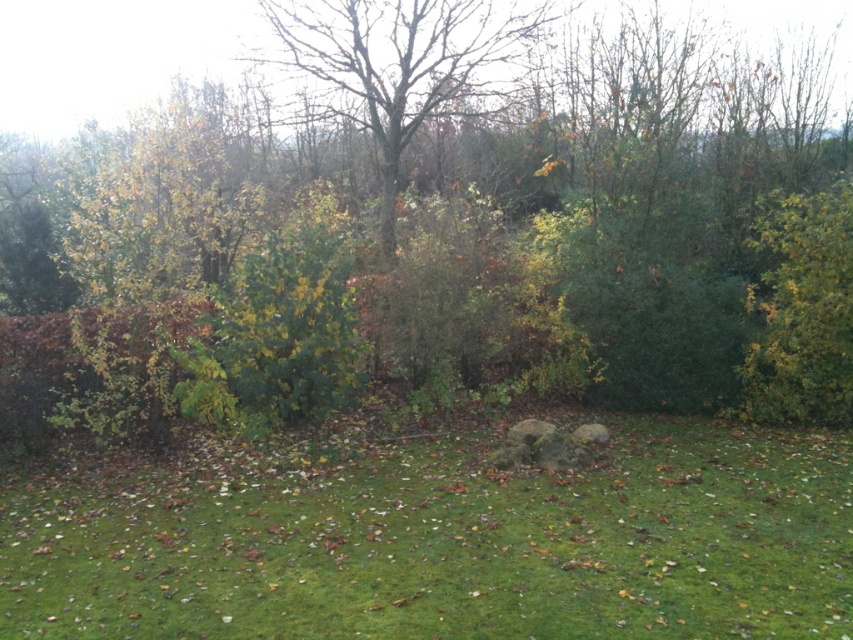
Based on the photo, you are standing in the autumn scene and want to take a photo. There are two points in the image, point (318, 385) and point (465, 17). Which point will appear larger in your photo?

Point (318, 385) is closer to the camera than point (465, 17), so it will appear larger in the photo.

You are standing in the autumn scene and want to place a small garden ornament between the green leafy bush at center and the bare wood tree at center. Based on their positions, which side of the tree should you place it to ensure it is between them?

The green leafy bush at center is to the left of the bare wood tree at center, so placing the ornament to the left side of the tree would position it between them.

You are standing in the middle of the green grassy area at center and want to walk to the edge of the green leafy tree at center. Is the distance you need to walk likely shorter than 10 meters?

The green leafy tree at center might be wider than green grassy area at center, so the distance to walk to the edge of the green leafy tree at center could be less than 10 meters depending on the actual width of the tree.